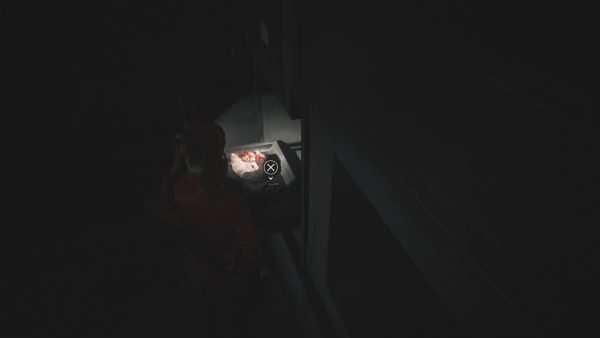
Locate an element on the screen. frames is located at coordinates (316, 230), (374, 191), (300, 289).